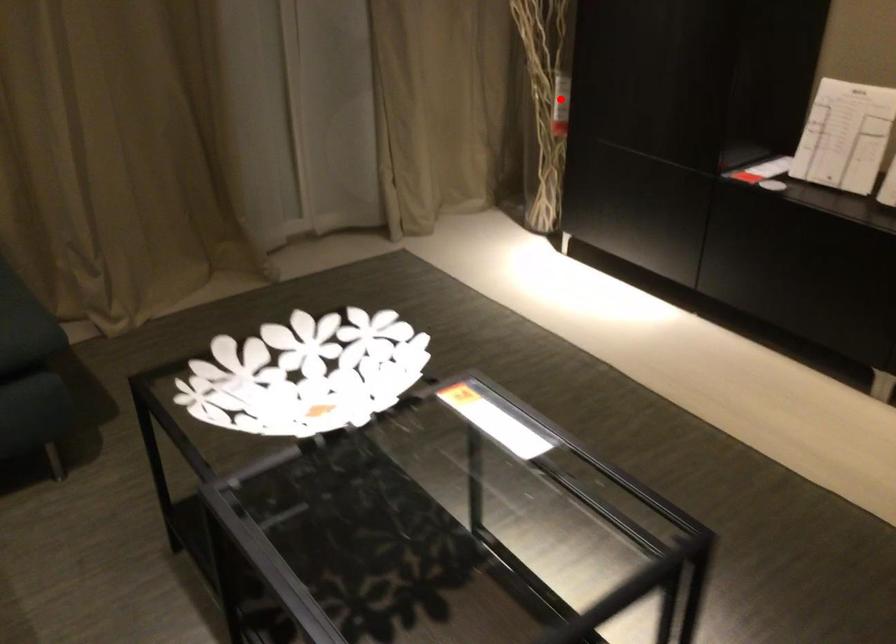
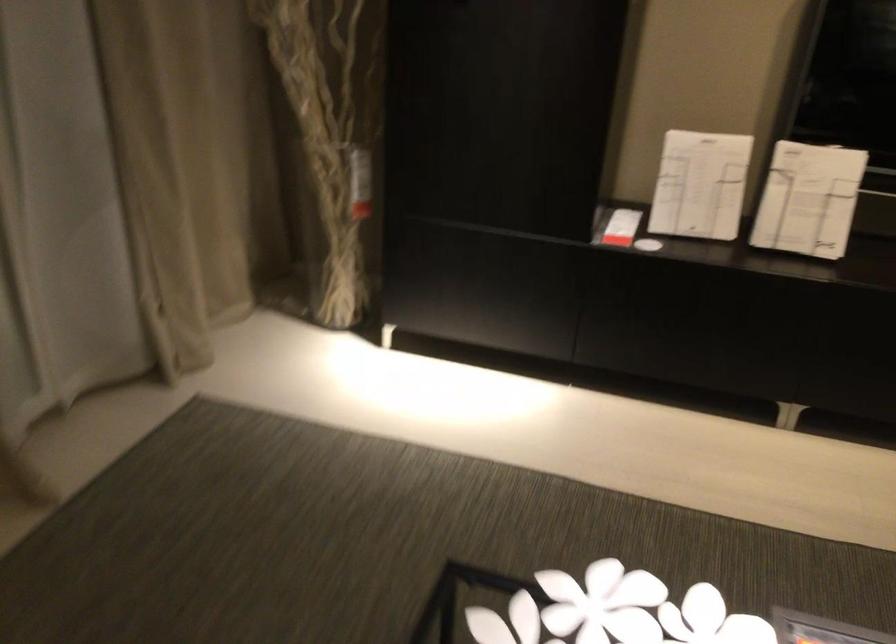
Question: I am providing you with two images of the same scene from different viewpoints. Image1 has a red point marked. In image2, the corresponding 3D location appears at what relative position? Reply with the corresponding letter.

Choices:
 (A) Closer
 (B) Farther

Answer: (A)